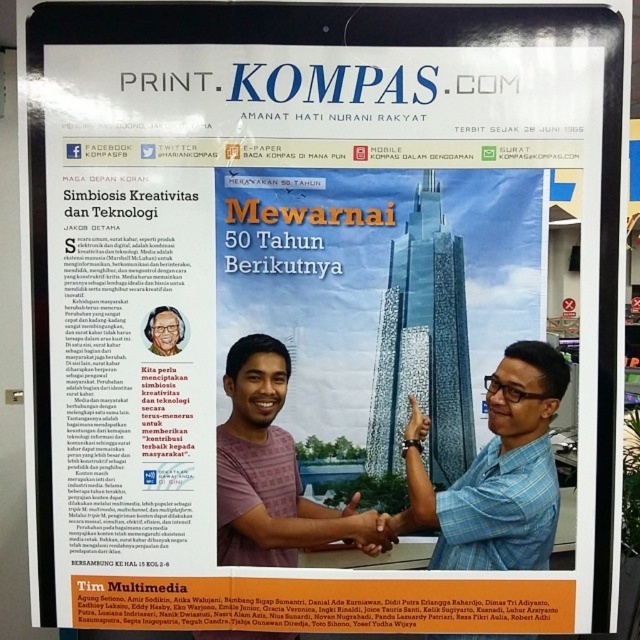
Is purple cotton shirt at center positioned in front of matte blue hand at center?

Yes, purple cotton shirt at center is in front of matte blue hand at center.

Who is more forward, (x=218, y=481) or (x=369, y=525)?

Positioned in front is point (x=218, y=481).

Does point (241, 557) come farther from viewer compared to point (378, 516)?

No.

Locate an element on the screen. The width and height of the screenshot is (640, 640). purple cotton shirt at center is located at coordinates (273, 472).

Between matte black glasses at upper left and black leather bracelet at center, which one has less height?

Standing shorter between the two is black leather bracelet at center.

Is point (156, 344) positioned in front of point (410, 406)?

Yes, point (156, 344) is in front of point (410, 406).

Which is behind, point (164, 324) or point (417, 420)?

Point (417, 420)

Where is `matte black glasses at upper left`? Image resolution: width=640 pixels, height=640 pixels. matte black glasses at upper left is located at coordinates (164, 330).

Which is more to the right, blue checkered shirt at center or black leather bracelet at center?

blue checkered shirt at center

Between blue checkered shirt at center and black leather bracelet at center, which one is positioned higher?

black leather bracelet at center

What do you see at coordinates (499, 474) in the screenshot? I see `blue checkered shirt at center` at bounding box center [499, 474].

Locate an element on the screen. This screenshot has width=640, height=640. blue checkered shirt at center is located at coordinates (499, 474).